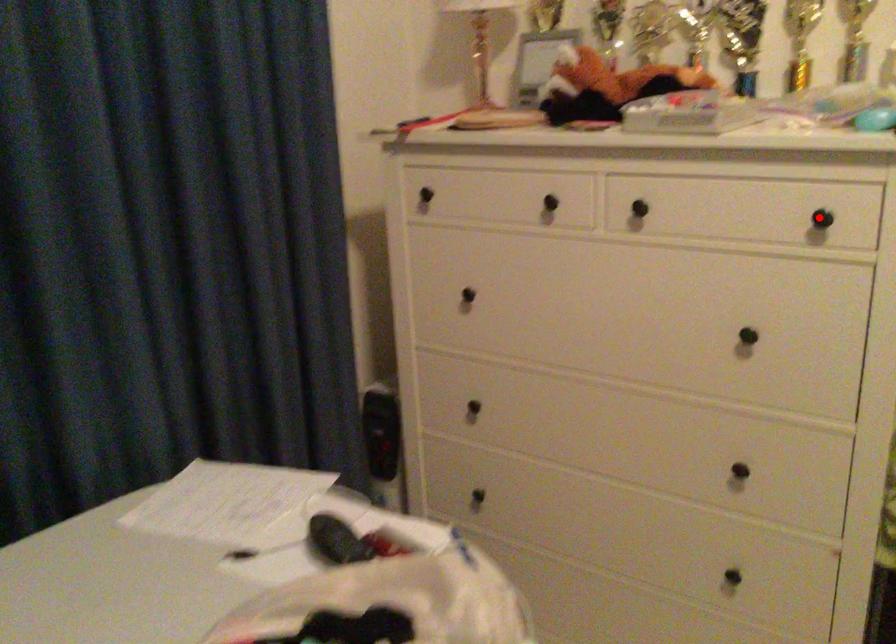
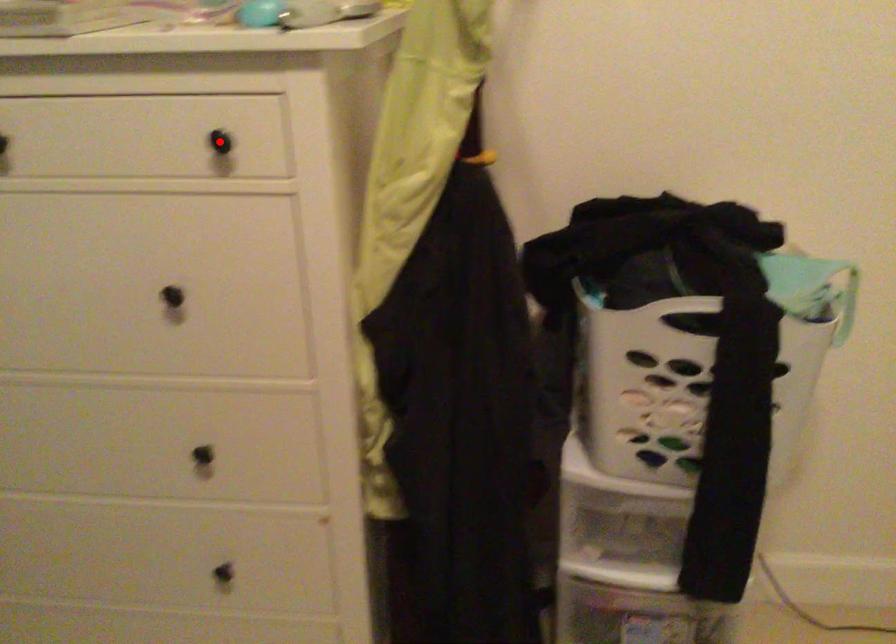
I am providing you with two images of the same scene from different viewpoints. A red point is marked on the first image and another point is marked on the second image. Does the point marked in image1 correspond to the same location as the one in image2?

Yes